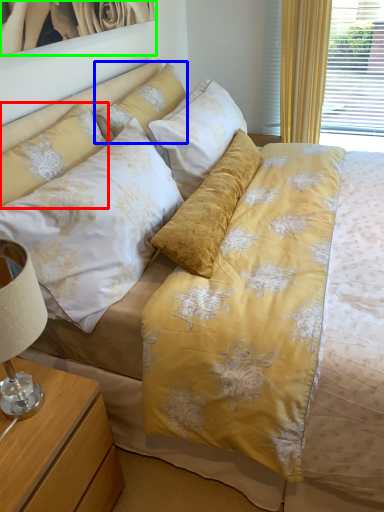
Question: Based on their relative distances, which object is nearer to pillow (highlighted by a red box)? Choose from pillow (highlighted by a blue box) and picture frame (highlighted by a green box).

Choices:
 (A) pillow
 (B) picture frame

Answer: (A)